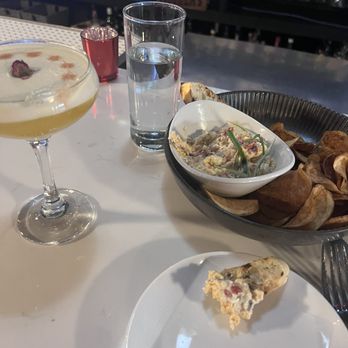
At what (x,y) coordinates should I click in order to perform the action: click on foam. Please return your answer as a coordinate pair (x, y). Looking at the image, I should click on (32, 83).